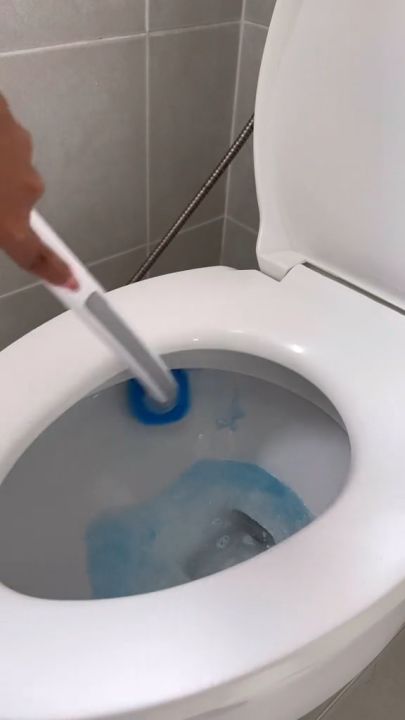
The width and height of the screenshot is (405, 720). Identify the location of seat. (39, 405).